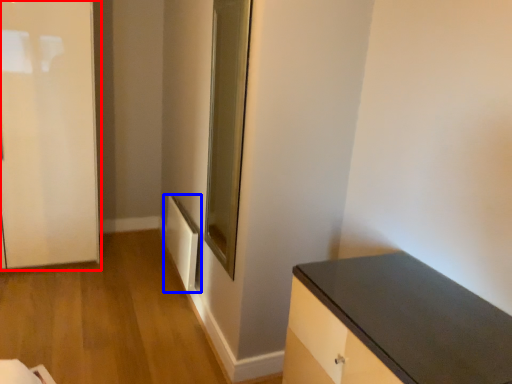
Question: Which point is closer to the camera, door (highlighted by a red box) or radiator (highlighted by a blue box)?

Choices:
 (A) door
 (B) radiator

Answer: (A)